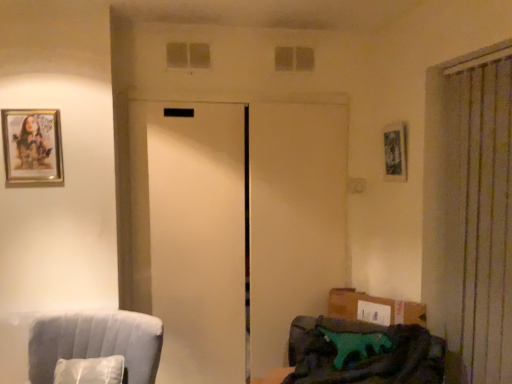
Question: Considering the relative positions of green fabric pillow at lower right and metallic silver picture frame at upper right, which is the 2th picture frame in front-to-back order, in the image provided, is green fabric pillow at lower right to the left of metallic silver picture frame at upper right, which is the 2th picture frame in front-to-back order, from the viewer's perspective?

Choices:
 (A) yes
 (B) no

Answer: (A)

Question: Considering the relative sizes of green fabric pillow at lower right and metallic silver picture frame at upper right, the first picture frame when ordered from right to left, in the image provided, is green fabric pillow at lower right taller than metallic silver picture frame at upper right, the first picture frame when ordered from right to left,?

Choices:
 (A) no
 (B) yes

Answer: (A)

Question: Is green fabric pillow at lower right in front of metallic silver picture frame at upper right, the 1th picture frame in the back-to-front sequence?

Choices:
 (A) no
 (B) yes

Answer: (B)

Question: Does green fabric pillow at lower right have a lesser height compared to metallic silver picture frame at upper right, which is the 2th picture frame in left-to-right order?

Choices:
 (A) yes
 (B) no

Answer: (A)

Question: Does green fabric pillow at lower right turn towards metallic silver picture frame at upper right, which is the 2th picture frame in left-to-right order?

Choices:
 (A) no
 (B) yes

Answer: (A)

Question: From the image's perspective, is metallic silver picture frame at upper right, the 1th picture frame in the back-to-front sequence, located above or below velvet blue armchair at lower left, the second furniture from the right?

Choices:
 (A) above
 (B) below

Answer: (A)

Question: Based on their sizes in the image, would you say metallic silver picture frame at upper right, the first picture frame when ordered from right to left, is bigger or smaller than velvet blue armchair at lower left, arranged as the first furniture when viewed from the left?

Choices:
 (A) big
 (B) small

Answer: (B)

Question: In terms of height, does metallic silver picture frame at upper right, the first picture frame when ordered from right to left, look taller or shorter compared to velvet blue armchair at lower left, the second furniture from the right?

Choices:
 (A) short
 (B) tall

Answer: (A)

Question: Based on their positions, is metallic silver picture frame at upper right, the first picture frame when ordered from right to left, located to the left or right of velvet blue armchair at lower left, arranged as the first furniture when viewed from the left?

Choices:
 (A) left
 (B) right

Answer: (B)

Question: In terms of size, does translucent glass window at upper center, positioned as the 2th window in left-to-right order, appear bigger or smaller than green fabric pillow at lower right?

Choices:
 (A) big
 (B) small

Answer: (B)

Question: Is translucent glass window at upper center, which is the 1th window in back-to-front order, situated inside green fabric pillow at lower right or outside?

Choices:
 (A) inside
 (B) outside

Answer: (B)

Question: Considering their positions, is translucent glass window at upper center, the 1th window in the right-to-left sequence, located in front of or behind green fabric pillow at lower right?

Choices:
 (A) behind
 (B) front

Answer: (A)

Question: In the image, is translucent glass window at upper center, positioned as the 2th window in left-to-right order, on the left side or the right side of green fabric pillow at lower right?

Choices:
 (A) left
 (B) right

Answer: (A)

Question: Visually, is metallic silver picture frame at upper right, the 1th picture frame in the back-to-front sequence, positioned to the left or to the right of gold-framed picture at upper left, which is the 1th picture frame in left-to-right order?

Choices:
 (A) left
 (B) right

Answer: (B)

Question: Is metallic silver picture frame at upper right, the 1th picture frame in the back-to-front sequence, bigger or smaller than gold-framed picture at upper left, which is the second picture frame in right-to-left order?

Choices:
 (A) small
 (B) big

Answer: (B)